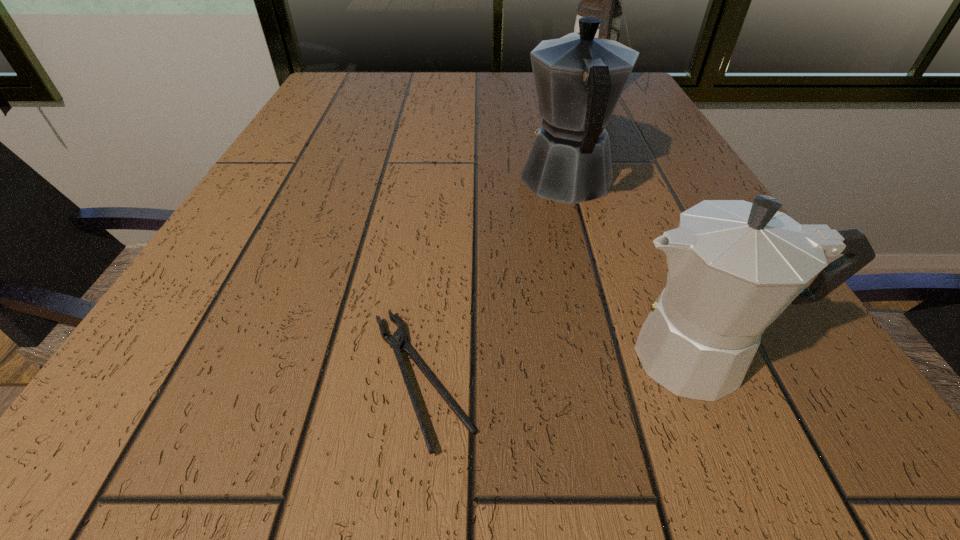
Identify the location of empty space between the third nearest object and the third tallest object. The width and height of the screenshot is (960, 540). (636, 269).

Image resolution: width=960 pixels, height=540 pixels. Find the location of `free space between the oil lamp and the shorter coffeepot`. free space between the oil lamp and the shorter coffeepot is located at coordinates (647, 224).

Find the location of `vacant space that is in between the third nearest object and the leftmost object`. vacant space that is in between the third nearest object and the leftmost object is located at coordinates (494, 280).

At what (x,y) coordinates should I click in order to perform the action: click on free space between the farther coffeepot and the leftmost object. Please return your answer as a coordinate pair (x, y). Looking at the image, I should click on (494, 280).

Choose which object is the nearest neighbor to the nearer coffeepot. Please provide its 2D coordinates. Your answer should be formatted as a tuple, i.e. [(x, y)], where the tuple contains the x and y coordinates of a point satisfying the conditions above.

[(396, 341)]

Identify which object is located as the nearest to the leftmost object. Please provide its 2D coordinates. Your answer should be formatted as a tuple, i.e. [(x, y)], where the tuple contains the x and y coordinates of a point satisfying the conditions above.

[(733, 266)]

At what (x,y) coordinates should I click in order to perform the action: click on free space that satisfies the following two spatial constraints: 1. at the spout of the farther coffeepot; 2. on the right side of the oil lamp. Please return your answer as a coordinate pair (x, y). Looking at the image, I should click on 543,92.

Where is `vacant position in the image that satisfies the following two spatial constraints: 1. at the spout of the second shortest object; 2. on the front side of the tongs`? vacant position in the image that satisfies the following two spatial constraints: 1. at the spout of the second shortest object; 2. on the front side of the tongs is located at coordinates (713, 379).